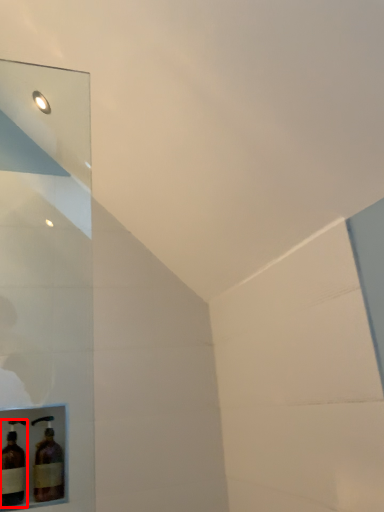
Question: From the image's perspective, considering the relative positions of bottle (annotated by the red box) and bottle in the image provided, where is bottle (annotated by the red box) located with respect to the staircase?

Choices:
 (A) above
 (B) below

Answer: (A)